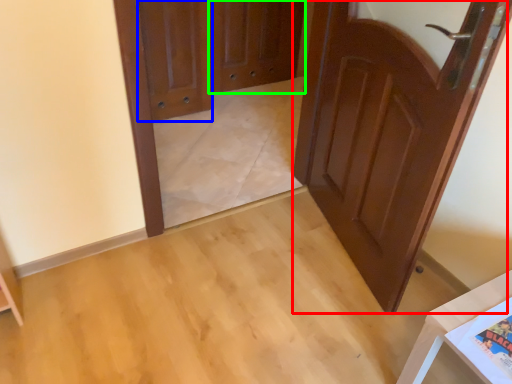
Question: Which is nearer to the door (highlighted by a red box)? door (highlighted by a blue box) or screen door (highlighted by a green box).

Choices:
 (A) door
 (B) screen door

Answer: (A)